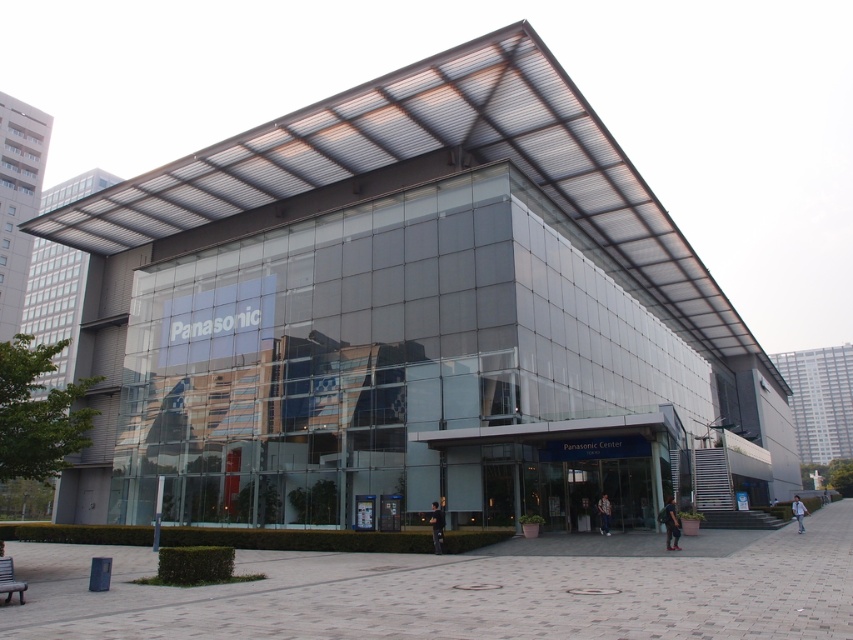
Which of these two, black matte jacket at center or camouflage-patterned shirt at center, stands shorter?

With less height is camouflage-patterned shirt at center.

Is black matte jacket at center thinner than camouflage-patterned shirt at center?

No.

You are a GUI agent. You are given a task and a screenshot of the screen. Output one action in this format:
    pyautogui.click(x=<x>, y=<y>)
    Task: Click on the black matte jacket at center
    This screenshot has width=853, height=640.
    Given the screenshot: What is the action you would take?
    pyautogui.click(x=436, y=525)

Looking at this image, between camouflage-patterned shirt at center and light blue denim jacket at lower right, which one has more height?

light blue denim jacket at lower right

Between camouflage-patterned shirt at center and light blue denim jacket at lower right, which one appears on the right side from the viewer's perspective?

Positioned to the right is light blue denim jacket at lower right.

Between point (610, 508) and point (802, 531), which one is positioned in front?

Point (610, 508)

Where is `camouflage-patterned shirt at center`? camouflage-patterned shirt at center is located at coordinates (604, 513).

Identify the location of black matte jacket at center. The height and width of the screenshot is (640, 853). (436, 525).

Can you confirm if black matte jacket at center is positioned below light blue denim jacket at lower right?

Actually, black matte jacket at center is above light blue denim jacket at lower right.

Where is `black matte jacket at center`? black matte jacket at center is located at coordinates (436, 525).